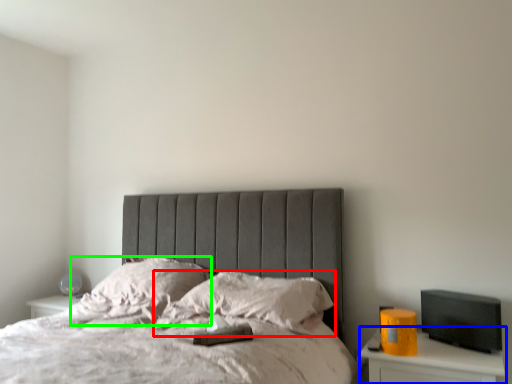
Question: Considering the real-world distances, which object is farthest from pillow (highlighted by a red box)? nightstand (highlighted by a blue box) or pillow (highlighted by a green box)?

Choices:
 (A) nightstand
 (B) pillow

Answer: (A)